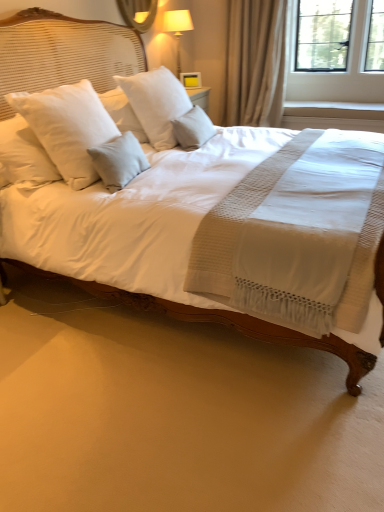
Image resolution: width=384 pixels, height=512 pixels. Describe the element at coordinates (193, 128) in the screenshot. I see `light gray fabric pillow at center, the 3th pillow in the left-to-right sequence` at that location.

This screenshot has height=512, width=384. What do you see at coordinates (255, 62) in the screenshot?
I see `beige fabric curtain at upper right` at bounding box center [255, 62].

This screenshot has height=512, width=384. What are the coordinates of `white soft pillow at upper left, arranged as the 3th pillow when viewed from the right` in the screenshot? It's located at (68, 127).

Which of these two, white soft pillow at center, marked as the second pillow in a right-to-left arrangement, or white wood at upper right, stands taller?

Standing taller between the two is white soft pillow at center, marked as the second pillow in a right-to-left arrangement.

From the image's perspective, is white soft pillow at center, which is the 2th pillow from left to right, below white wood at upper right?

Indeed, from the image's perspective, white soft pillow at center, which is the 2th pillow from left to right, is shown beneath white wood at upper right.

Looking at this image, is white soft pillow at center, marked as the second pillow in a right-to-left arrangement, thinner than white wood at upper right?

Indeed, white soft pillow at center, marked as the second pillow in a right-to-left arrangement, has a lesser width compared to white wood at upper right.

Does white soft pillow at center, marked as the second pillow in a right-to-left arrangement, have a larger size compared to white wood at upper right?

Yes.

Is point (188, 121) behind point (153, 2)?

No, (188, 121) is in front of (153, 2).

Considering the positions of objects light gray fabric pillow at center, the 3th pillow in the left-to-right sequence, and glossy glass mirror at upper center in the image provided, who is more to the left, light gray fabric pillow at center, the 3th pillow in the left-to-right sequence, or glossy glass mirror at upper center?

glossy glass mirror at upper center is more to the left.

Considering the sizes of objects light gray fabric pillow at center, the 1th pillow viewed from the right, and glossy glass mirror at upper center in the image provided, who is taller, light gray fabric pillow at center, the 1th pillow viewed from the right, or glossy glass mirror at upper center?

With more height is light gray fabric pillow at center, the 1th pillow viewed from the right.

Is light gray fabric pillow at center, the 3th pillow in the left-to-right sequence, looking in the opposite direction of glossy glass mirror at upper center?

That's not correct — light gray fabric pillow at center, the 3th pillow in the left-to-right sequence, is not looking away from glossy glass mirror at upper center.

Is beige fabric curtain at upper right surrounded by light gray fabric pillow at center, the 3th pillow in the left-to-right sequence?

No, beige fabric curtain at upper right is not a part of light gray fabric pillow at center, the 3th pillow in the left-to-right sequence.

Can you confirm if light gray fabric pillow at center, the 3th pillow in the left-to-right sequence, is smaller than beige fabric curtain at upper right?

Yes.

From the image's perspective, between light gray fabric pillow at center, the 1th pillow viewed from the right, and beige fabric curtain at upper right, who is located below?

light gray fabric pillow at center, the 1th pillow viewed from the right, appears lower in the image.

How much distance is there between light gray fabric pillow at center, the 3th pillow in the left-to-right sequence, and beige fabric curtain at upper right?

light gray fabric pillow at center, the 3th pillow in the left-to-right sequence, and beige fabric curtain at upper right are 1.54 meters apart from each other.

From the image's perspective, does white wood at upper right appear higher than white soft pillow at center, which is the 2th pillow from left to right?

Correct, white wood at upper right appears higher than white soft pillow at center, which is the 2th pillow from left to right, in the image.

How much distance is there between white wood at upper right and white soft pillow at center, which is the 2th pillow from left to right?

white wood at upper right is 6.75 feet away from white soft pillow at center, which is the 2th pillow from left to right.

Is white wood at upper right turned away from white soft pillow at center, marked as the second pillow in a right-to-left arrangement?

white wood at upper right does not have its back to white soft pillow at center, marked as the second pillow in a right-to-left arrangement.

Looking at this image, from their relative heights in the image, would you say white wood at upper right is taller or shorter than white soft pillow at center, which is the 2th pillow from left to right?

In the image, white wood at upper right appears to be shorter than white soft pillow at center, which is the 2th pillow from left to right.

Is beige fabric curtain at upper right looking in the opposite direction of white wood at upper right?

That's not correct — beige fabric curtain at upper right is not looking away from white wood at upper right.

Does beige fabric curtain at upper right have a smaller size compared to white wood at upper right?

No, beige fabric curtain at upper right is not smaller than white wood at upper right.

In the scene shown: Does beige fabric curtain at upper right have a greater height compared to white wood at upper right?

Correct, beige fabric curtain at upper right is much taller as white wood at upper right.

How different are the orientations of beige fabric curtain at upper right and white wood at upper right in degrees?

The facing directions of beige fabric curtain at upper right and white wood at upper right are 0.48 degrees apart.

Is point (153, 84) less distant than point (228, 47)?

Yes, point (153, 84) is closer to viewer.

Is white soft pillow at center, which is the 2th pillow from left to right, oriented away from beige fabric curtain at upper right?

No.

From the image's perspective, who appears lower, white soft pillow at center, marked as the second pillow in a right-to-left arrangement, or beige fabric curtain at upper right?

white soft pillow at center, marked as the second pillow in a right-to-left arrangement, from the image's perspective.

Considering the relative positions of white soft pillow at center, marked as the second pillow in a right-to-left arrangement, and beige fabric curtain at upper right in the image provided, is white soft pillow at center, marked as the second pillow in a right-to-left arrangement, to the left of beige fabric curtain at upper right from the viewer's perspective?

Yes.

How far apart are beige fabric curtain at upper right and light gray fabric pillow at center, the 1th pillow viewed from the right?

beige fabric curtain at upper right is 1.54 meters from light gray fabric pillow at center, the 1th pillow viewed from the right.

Is beige fabric curtain at upper right turned away from light gray fabric pillow at center, the 3th pillow in the left-to-right sequence?

No, beige fabric curtain at upper right is not facing the opposite direction of light gray fabric pillow at center, the 3th pillow in the left-to-right sequence.

From a real-world perspective, which object stands above the other?

beige fabric curtain at upper right is physically above.

Is point (256, 30) closer or farther from the camera than point (199, 135)?

Clearly, point (256, 30) is more distant from the camera than point (199, 135).

From the image's perspective, which pillow is the 1st one below the white wood at upper right? Please provide its 2D coordinates.

[(156, 103)]

Identify the location of mirror above the light gray fabric pillow at center, the 3th pillow in the left-to-right sequence (from a real-world perspective). (138, 13).

Based on their spatial positions, is white wood at upper right or glossy glass mirror at upper center closer to beige fabric curtain at upper right?

The object closer to beige fabric curtain at upper right is white wood at upper right.

Considering their positions, is white soft pillow at upper left, arranged as the 3th pillow when viewed from the right, positioned closer to light gray fabric pillow at center, the 1th pillow viewed from the right, than white soft pillow at center, marked as the second pillow in a right-to-left arrangement?

white soft pillow at center, marked as the second pillow in a right-to-left arrangement.

Looking at the image, which one is located further to white wood at upper right, white soft pillow at center, marked as the second pillow in a right-to-left arrangement, or light gray fabric pillow at center, the 3th pillow in the left-to-right sequence?

white soft pillow at center, marked as the second pillow in a right-to-left arrangement, is further to white wood at upper right.

When comparing their distances from white soft pillow at upper left, the 1th pillow positioned from the left, does white wood at upper right or light gray fabric pillow at center, the 1th pillow viewed from the right, seem further?

Based on the image, white wood at upper right appears to be further to white soft pillow at upper left, the 1th pillow positioned from the left.

Estimate the real-world distances between objects in this image. Which object is closer to beige fabric curtain at upper right, white soft pillow at upper left, arranged as the 3th pillow when viewed from the right, or light gray fabric pillow at center, the 3th pillow in the left-to-right sequence?

Among the two, light gray fabric pillow at center, the 3th pillow in the left-to-right sequence, is located nearer to beige fabric curtain at upper right.

Considering their positions, is light gray fabric pillow at center, the 1th pillow viewed from the right, positioned closer to beige fabric curtain at upper right than matte white lampshade at upper center?

matte white lampshade at upper center lies closer to beige fabric curtain at upper right than the other object.

Considering their positions, is beige fabric curtain at upper right positioned closer to glossy glass mirror at upper center than matte white lampshade at upper center?

Among the two, matte white lampshade at upper center is located nearer to glossy glass mirror at upper center.

Considering their positions, is light gray fabric pillow at center, the 3th pillow in the left-to-right sequence, positioned further to white soft pillow at center, marked as the second pillow in a right-to-left arrangement, than white soft pillow at upper left, arranged as the 3th pillow when viewed from the right?

The object further to white soft pillow at center, marked as the second pillow in a right-to-left arrangement, is white soft pillow at upper left, arranged as the 3th pillow when viewed from the right.

Where is `curtain between white soft pillow at upper left, arranged as the 3th pillow when viewed from the right, and white wood at upper right from front to back`? curtain between white soft pillow at upper left, arranged as the 3th pillow when viewed from the right, and white wood at upper right from front to back is located at coordinates (255, 62).

Find the location of a particular element. This screenshot has width=384, height=512. curtain between white soft pillow at center, which is the 2th pillow from left to right, and white wood at upper right, along the z-axis is located at coordinates (255, 62).

At what (x,y) coordinates should I click in order to perform the action: click on curtain located between glossy glass mirror at upper center and white wood at upper right in the left-right direction. Please return your answer as a coordinate pair (x, y). Looking at the image, I should click on (255, 62).

This screenshot has width=384, height=512. Identify the location of bedside lamp between glossy glass mirror at upper center and white wood at upper right. (177, 29).